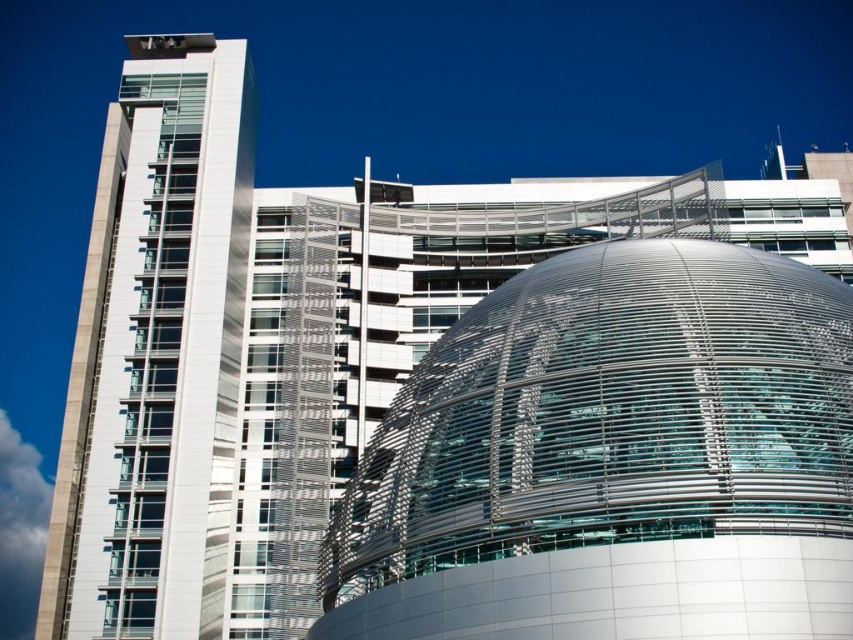
Question: Which object appears closest to the camera in this image?

Choices:
 (A) transparent glass dome at center
 (B) white glass building at left

Answer: (A)

Question: Which point is farther from the camera taking this photo?

Choices:
 (A) (144, 589)
 (B) (643, 448)

Answer: (A)

Question: Is transparent glass dome at center closer to camera compared to white glass building at left?

Choices:
 (A) no
 (B) yes

Answer: (B)

Question: Is transparent glass dome at center to the left of white glass building at left from the viewer's perspective?

Choices:
 (A) no
 (B) yes

Answer: (A)

Question: Can you confirm if transparent glass dome at center is positioned below white glass building at left?

Choices:
 (A) yes
 (B) no

Answer: (A)